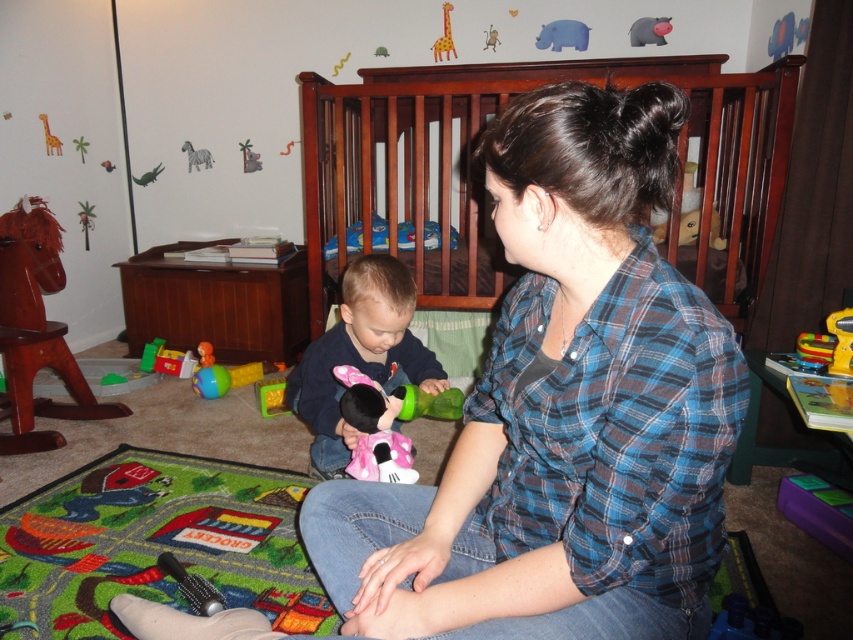
Is wooden crib at center further to camera compared to yellow matte giraffe at upper center?

No, it is in front of yellow matte giraffe at upper center.

Between wooden crib at center and yellow matte giraffe at upper center, which one appears on the right side from the viewer's perspective?

From the viewer's perspective, wooden crib at center appears more on the right side.

Where is `wooden crib at center`? The image size is (853, 640). wooden crib at center is located at coordinates (480, 177).

Where is `wooden crib at center`? This screenshot has width=853, height=640. wooden crib at center is located at coordinates (480, 177).

Who is more forward, (718,106) or (328,465)?

Point (328,465)

Is point (387, 134) less distant than point (378, 260)?

That is False.

Does point (450, 246) come in front of point (398, 276)?

No, it is not.

Where is `wooden crib at center`? The width and height of the screenshot is (853, 640). wooden crib at center is located at coordinates 480,177.

Is matte pink plush toy at center wider than yellow matte giraffe at upper center?

Indeed, matte pink plush toy at center has a greater width compared to yellow matte giraffe at upper center.

Does point (321, 358) lie behind point (444, 51)?

No, (321, 358) is closer to viewer.

Describe the element at coordinates (360, 356) in the screenshot. I see `matte pink plush toy at center` at that location.

Where is `matte pink plush toy at center`? matte pink plush toy at center is located at coordinates (360, 356).